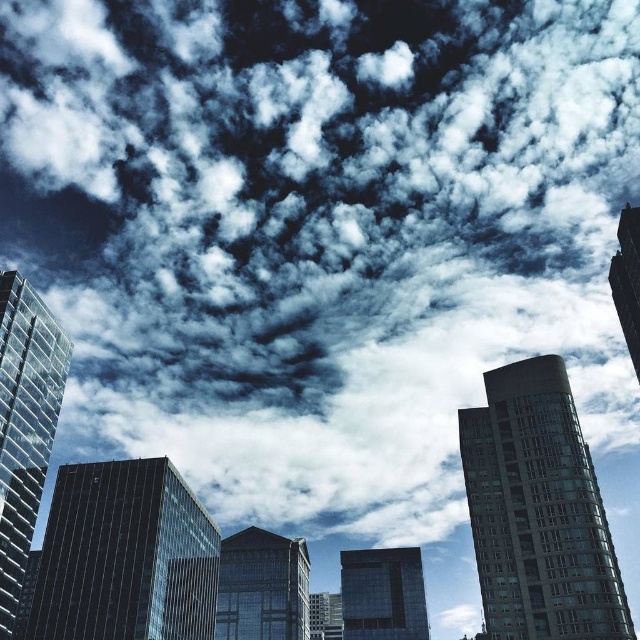
Question: Which of these objects is positioned farthest from the glassy reflective skyscraper at center?

Choices:
 (A) transparent glass skyscraper at left
 (B) black glass building at center
 (C) glassy reflective tower at center

Answer: (C)

Question: Where is glassy reflective skyscraper at center located in relation to smooth glass skyscraper at upper right in the image?

Choices:
 (A) below
 (B) above

Answer: (A)

Question: Is glassy reflective skyscraper at center to the right of glassy black building at center from the viewer's perspective?

Choices:
 (A) yes
 (B) no

Answer: (B)

Question: Which object is positioned farthest from the glassy reflective tower at center?

Choices:
 (A) smooth glass skyscraper at upper right
 (B) transparent glass skyscraper at left
 (C) black glass building at center
 (D) glassy reflective skyscraper at center

Answer: (D)

Question: Which point is farther from the camera taking this photo?

Choices:
 (A) (634, 241)
 (B) (364, 579)
 (C) (522, 371)
 (D) (113, 468)

Answer: (B)

Question: Is glassy reflective tower at center wider than smooth glass skyscraper at upper right?

Choices:
 (A) no
 (B) yes

Answer: (B)